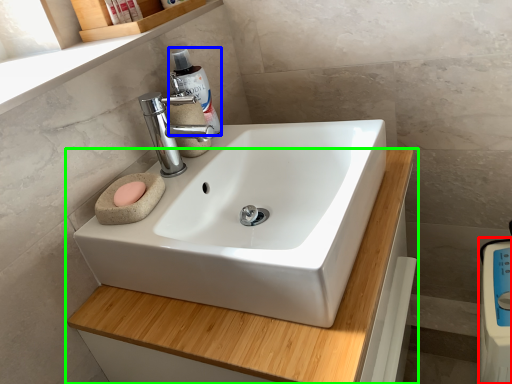
Question: Which object is positioned closest to appliance (highlighted by a red box)? Select from cleaning product (highlighted by a blue box) and bathroom cabinet (highlighted by a green box).

Choices:
 (A) cleaning product
 (B) bathroom cabinet

Answer: (B)